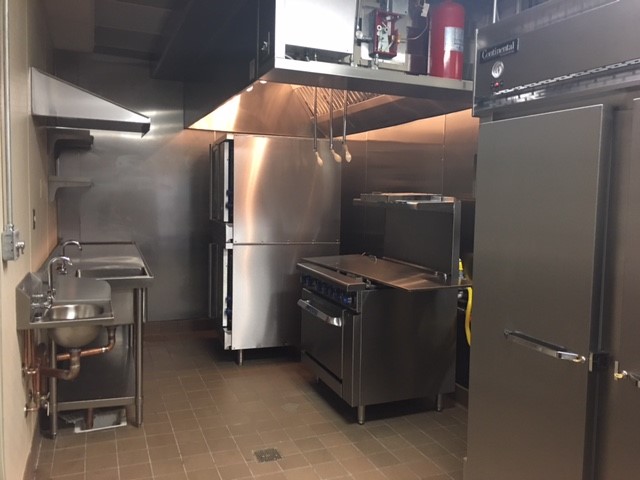
This screenshot has width=640, height=480. I want to click on floor, so click(242, 419).